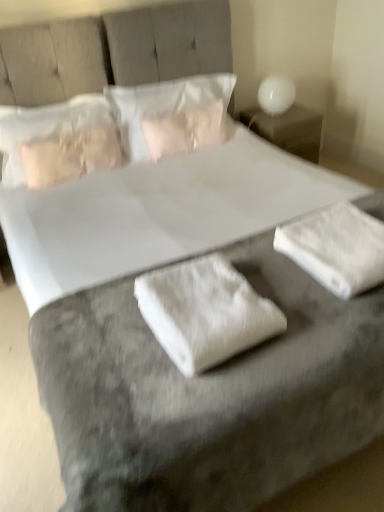
Identify the location of free spot to the left of white fabric at center, positioned as the first material in left-to-right order. (103, 332).